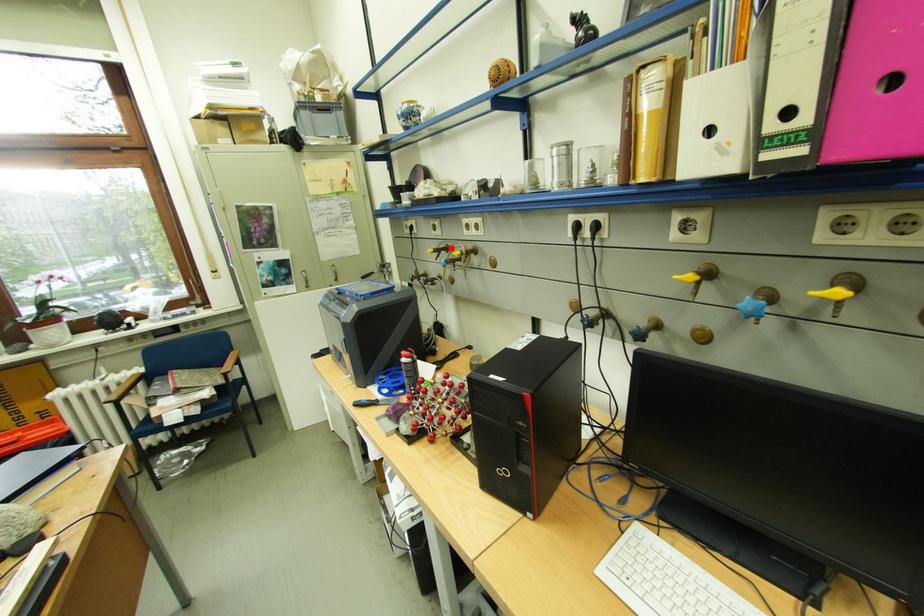
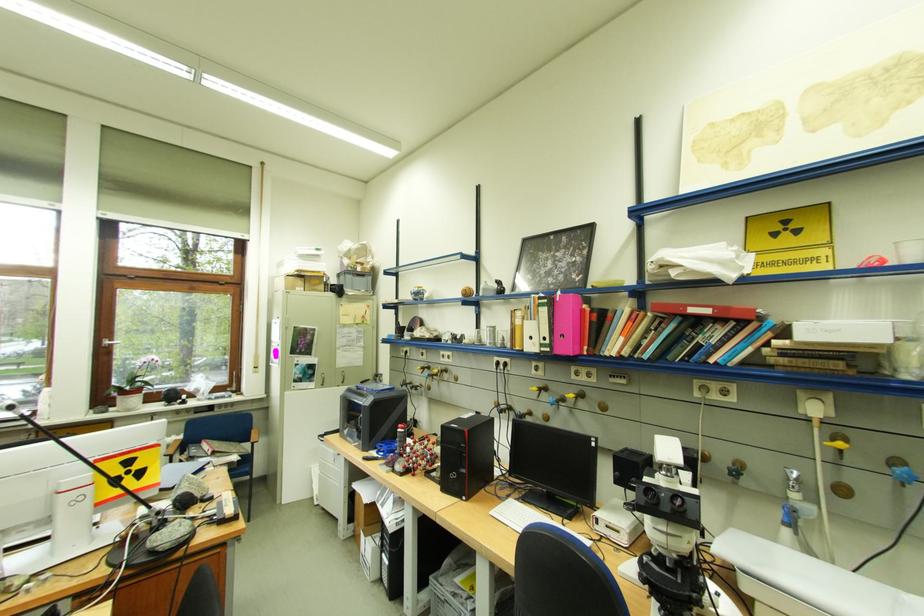
Question: I am providing you with two images of the same scene from different viewpoints. In image1, a red point is highlighted. Considering the same 3D point in image2, which of the following is correct?

Choices:
 (A) It is closer
 (B) It is farther

Answer: (B)